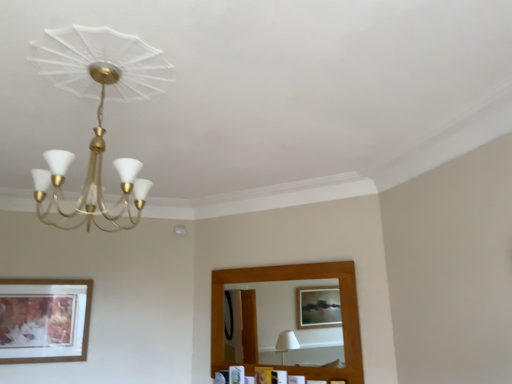
At what (x,y) coordinates should I click in order to perform the action: click on wooden picture frame at lower center, acting as the third picture frame starting from the left. Please return your answer as a coordinate pair (x, y). Looking at the image, I should click on [x=264, y=375].

What do you see at coordinates (44, 320) in the screenshot?
I see `wooden picture frame at lower left, the 3th picture frame from the right` at bounding box center [44, 320].

What do you see at coordinates (237, 374) in the screenshot?
I see `wooden picture frame at lower center, placed as the second picture frame when sorted from right to left` at bounding box center [237, 374].

You are a GUI agent. You are given a task and a screenshot of the screen. Output one action in this format:
    pyautogui.click(x=<x>, y=<y>)
    Task: Click on the wooden picture frame at lower center, marked as the first picture frame in a right-to-left arrangement
    The width and height of the screenshot is (512, 384).
    Given the screenshot: What is the action you would take?
    pyautogui.click(x=264, y=375)

Consider the image. Considering the relative sizes of wooden picture frame at lower center, placed as the second picture frame when sorted from right to left, and matte gold chandelier at upper left in the image provided, is wooden picture frame at lower center, placed as the second picture frame when sorted from right to left, bigger than matte gold chandelier at upper left?

No, wooden picture frame at lower center, placed as the second picture frame when sorted from right to left, is not bigger than matte gold chandelier at upper left.

Is wooden picture frame at lower center, positioned as the second picture frame in left-to-right order, thinner than matte gold chandelier at upper left?

Correct, the width of wooden picture frame at lower center, positioned as the second picture frame in left-to-right order, is less than that of matte gold chandelier at upper left.

Which of these two, wooden picture frame at lower center, positioned as the second picture frame in left-to-right order, or matte gold chandelier at upper left, stands taller?

matte gold chandelier at upper left.

Does point (271, 378) appear closer or farther from the camera than point (23, 328)?

Point (271, 378) is farther from the camera than point (23, 328).

Are wooden picture frame at lower center, acting as the third picture frame starting from the left, and wooden picture frame at lower left, the 3th picture frame from the right, located far from each other?

That's right, there is a large distance between wooden picture frame at lower center, acting as the third picture frame starting from the left, and wooden picture frame at lower left, the 3th picture frame from the right.

Is wooden picture frame at lower center, acting as the third picture frame starting from the left, aimed at wooden picture frame at lower left, which is the 1th picture frame in left-to-right order?

No.

Considering the sizes of objects wooden picture frame at lower center, acting as the third picture frame starting from the left, and wooden picture frame at lower left, the 3th picture frame from the right, in the image provided, who is wider, wooden picture frame at lower center, acting as the third picture frame starting from the left, or wooden picture frame at lower left, the 3th picture frame from the right,?

With larger width is wooden picture frame at lower center, acting as the third picture frame starting from the left.

Which is behind, wooden picture frame at lower center, placed as the second picture frame when sorted from right to left, or wooden picture frame at lower center, marked as the first picture frame in a right-to-left arrangement?

wooden picture frame at lower center, placed as the second picture frame when sorted from right to left, is further away from the camera.

Is wooden picture frame at lower center, positioned as the second picture frame in left-to-right order, positioned with its back to wooden picture frame at lower center, marked as the first picture frame in a right-to-left arrangement?

No, wooden picture frame at lower center, positioned as the second picture frame in left-to-right order, is not facing away from wooden picture frame at lower center, marked as the first picture frame in a right-to-left arrangement.

Between wooden picture frame at lower center, placed as the second picture frame when sorted from right to left, and wooden picture frame at lower center, acting as the third picture frame starting from the left, which one has larger size?

wooden picture frame at lower center, acting as the third picture frame starting from the left.

Would you say matte gold chandelier at upper left is a long distance from wooden picture frame at lower left, which is the 1th picture frame in left-to-right order?

matte gold chandelier at upper left is positioned a significant distance from wooden picture frame at lower left, which is the 1th picture frame in left-to-right order.

How many degrees apart are the facing directions of matte gold chandelier at upper left and wooden picture frame at lower left, the 3th picture frame from the right?

The angle between the facing direction of matte gold chandelier at upper left and the facing direction of wooden picture frame at lower left, the 3th picture frame from the right, is 89.8 degrees.

Is wooden picture frame at lower left, the 3th picture frame from the right, at the back of matte gold chandelier at upper left?

No, matte gold chandelier at upper left is not facing the opposite direction of wooden picture frame at lower left, the 3th picture frame from the right.

Locate an element on the screen. Image resolution: width=512 pixels, height=384 pixels. lamp above the wooden picture frame at lower left, which is the 1th picture frame in left-to-right order (from a real-world perspective) is located at coordinates (98, 114).

From their relative heights in the image, would you say matte gold chandelier at upper left is taller or shorter than wooden picture frame at lower center, placed as the second picture frame when sorted from right to left?

Considering their sizes, matte gold chandelier at upper left has more height than wooden picture frame at lower center, placed as the second picture frame when sorted from right to left.

Identify the location of the 3rd picture frame behind the matte gold chandelier at upper left, starting your count from the anchor. The height and width of the screenshot is (384, 512). (237, 374).

From a real-world perspective, which object stands above the other?

In real-world perspective, matte gold chandelier at upper left is above.

Is matte gold chandelier at upper left surrounding wooden picture frame at lower center, positioned as the second picture frame in left-to-right order?

No.

Based on their positions, is wooden picture frame at lower left, which is the 1th picture frame in left-to-right order, located to the left or right of wooden picture frame at lower center, positioned as the second picture frame in left-to-right order?

wooden picture frame at lower left, which is the 1th picture frame in left-to-right order, is positioned on wooden picture frame at lower center, positioned as the second picture frame in left-to-right order,'s left side.

Is the depth of wooden picture frame at lower left, the 3th picture frame from the right, less than that of wooden picture frame at lower center, placed as the second picture frame when sorted from right to left?

Yes, wooden picture frame at lower left, the 3th picture frame from the right, is closer to the camera.

From the image's perspective, between wooden picture frame at lower left, the 3th picture frame from the right, and wooden picture frame at lower center, positioned as the second picture frame in left-to-right order, which one is located above?

wooden picture frame at lower left, the 3th picture frame from the right, is shown above in the image.

Considering the sizes of wooden picture frame at lower left, the 3th picture frame from the right, and wooden picture frame at lower center, positioned as the second picture frame in left-to-right order, in the image, is wooden picture frame at lower left, the 3th picture frame from the right, bigger or smaller than wooden picture frame at lower center, positioned as the second picture frame in left-to-right order,?

Considering their sizes, wooden picture frame at lower left, the 3th picture frame from the right, takes up more space than wooden picture frame at lower center, positioned as the second picture frame in left-to-right order.

Where is `the 1st picture frame above the wooden picture frame at lower center, marked as the first picture frame in a right-to-left arrangement (from a real-world perspective)`? Image resolution: width=512 pixels, height=384 pixels. the 1st picture frame above the wooden picture frame at lower center, marked as the first picture frame in a right-to-left arrangement (from a real-world perspective) is located at coordinates (237, 374).

Considering the relative positions of wooden picture frame at lower center, acting as the third picture frame starting from the left, and wooden picture frame at lower center, placed as the second picture frame when sorted from right to left, in the image provided, is wooden picture frame at lower center, acting as the third picture frame starting from the left, to the right of wooden picture frame at lower center, placed as the second picture frame when sorted from right to left, from the viewer's perspective?

Correct, you'll find wooden picture frame at lower center, acting as the third picture frame starting from the left, to the right of wooden picture frame at lower center, placed as the second picture frame when sorted from right to left.

Looking at this image, could wooden picture frame at lower center, placed as the second picture frame when sorted from right to left, be considered to be inside wooden picture frame at lower center, acting as the third picture frame starting from the left?

No.

The width and height of the screenshot is (512, 384). Find the location of `lamp that appears above the wooden picture frame at lower center, positioned as the second picture frame in left-to-right order (from the image's perspective)`. lamp that appears above the wooden picture frame at lower center, positioned as the second picture frame in left-to-right order (from the image's perspective) is located at coordinates (98, 114).

Where is `the 1st picture frame behind the wooden picture frame at lower center, marked as the first picture frame in a right-to-left arrangement, counting from the anchor's position`? the 1st picture frame behind the wooden picture frame at lower center, marked as the first picture frame in a right-to-left arrangement, counting from the anchor's position is located at coordinates (44, 320).

From the image, which object appears to be farther from wooden picture frame at lower left, the 3th picture frame from the right, wooden picture frame at lower center, marked as the first picture frame in a right-to-left arrangement, or matte gold chandelier at upper left?

Based on the image, wooden picture frame at lower center, marked as the first picture frame in a right-to-left arrangement, appears to be further to wooden picture frame at lower left, the 3th picture frame from the right.

Based on their spatial positions, is wooden picture frame at lower center, acting as the third picture frame starting from the left, or matte gold chandelier at upper left further from wooden picture frame at lower center, positioned as the second picture frame in left-to-right order?

matte gold chandelier at upper left.

Considering their positions, is wooden picture frame at lower center, placed as the second picture frame when sorted from right to left, positioned closer to wooden picture frame at lower center, acting as the third picture frame starting from the left, than matte gold chandelier at upper left?

wooden picture frame at lower center, placed as the second picture frame when sorted from right to left, is positioned closer to the anchor wooden picture frame at lower center, acting as the third picture frame starting from the left.

From the image, which object appears to be farther from matte gold chandelier at upper left, wooden picture frame at lower left, which is the 1th picture frame in left-to-right order, or wooden picture frame at lower center, positioned as the second picture frame in left-to-right order?

wooden picture frame at lower center, positioned as the second picture frame in left-to-right order, is positioned further to the anchor matte gold chandelier at upper left.

Which object lies nearer to the anchor point wooden picture frame at lower center, placed as the second picture frame when sorted from right to left, matte gold chandelier at upper left or wooden picture frame at lower left, the 3th picture frame from the right?

The object closer to wooden picture frame at lower center, placed as the second picture frame when sorted from right to left, is wooden picture frame at lower left, the 3th picture frame from the right.

When comparing their distances from wooden picture frame at lower left, the 3th picture frame from the right, does wooden picture frame at lower center, positioned as the second picture frame in left-to-right order, or wooden picture frame at lower center, marked as the first picture frame in a right-to-left arrangement, seem further?

wooden picture frame at lower center, marked as the first picture frame in a right-to-left arrangement.

In the scene shown: Considering their positions, is wooden picture frame at lower left, which is the 1th picture frame in left-to-right order, positioned closer to matte gold chandelier at upper left than wooden picture frame at lower center, acting as the third picture frame starting from the left?

The object closer to matte gold chandelier at upper left is wooden picture frame at lower left, which is the 1th picture frame in left-to-right order.

Which object lies nearer to the anchor point wooden picture frame at lower center, marked as the first picture frame in a right-to-left arrangement, wooden picture frame at lower left, the 3th picture frame from the right, or wooden picture frame at lower center, placed as the second picture frame when sorted from right to left?

Among the two, wooden picture frame at lower center, placed as the second picture frame when sorted from right to left, is located nearer to wooden picture frame at lower center, marked as the first picture frame in a right-to-left arrangement.

Locate an element on the screen. Image resolution: width=512 pixels, height=384 pixels. picture frame between matte gold chandelier at upper left and wooden picture frame at lower left, which is the 1th picture frame in left-to-right order, in the front-back direction is located at coordinates (264, 375).

Locate an element on the screen. The height and width of the screenshot is (384, 512). picture frame situated between wooden picture frame at lower left, the 3th picture frame from the right, and wooden picture frame at lower center, acting as the third picture frame starting from the left, from left to right is located at coordinates (237, 374).